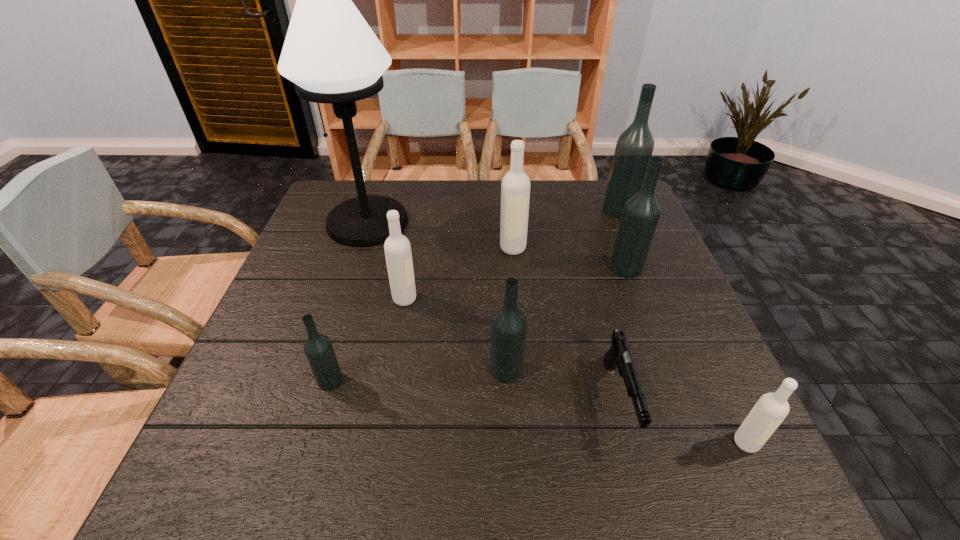
At what (x,y) coordinates should I click in order to perform the action: click on vacant space located 0.360m on the back of the third nearest black vodka. Please return your answer as a coordinate pair (x, y). The height and width of the screenshot is (540, 960). Looking at the image, I should click on (x=595, y=186).

Locate an element on the screen. The height and width of the screenshot is (540, 960). vacant region located on the front of the leftmost white vodka is located at coordinates (381, 433).

I want to click on vacant space located on the left of the second black vodka from left to right, so click(420, 370).

The height and width of the screenshot is (540, 960). I want to click on free space located on the back of the leftmost black vodka, so click(351, 309).

The height and width of the screenshot is (540, 960). I want to click on vacant space positioned 0.080m on the back of the nearest vodka, so click(722, 393).

You are a GUI agent. You are given a task and a screenshot of the screen. Output one action in this format:
    pyautogui.click(x=<x>, y=<y>)
    Task: Click on the vacant space situated 0.060m at the aiming end of the sixth object from left to right
    The image size is (960, 540).
    Given the screenshot: What is the action you would take?
    pyautogui.click(x=642, y=487)

In order to click on table lamp that is at the far edge in this screenshot , I will do `click(330, 53)`.

The image size is (960, 540). I want to click on vodka positioned at the far edge, so click(x=634, y=147).

Where is `vodka positioned at the near edge`? The width and height of the screenshot is (960, 540). vodka positioned at the near edge is located at coordinates (771, 409).

Identify the location of gun at the near edge. The image size is (960, 540). (618, 355).